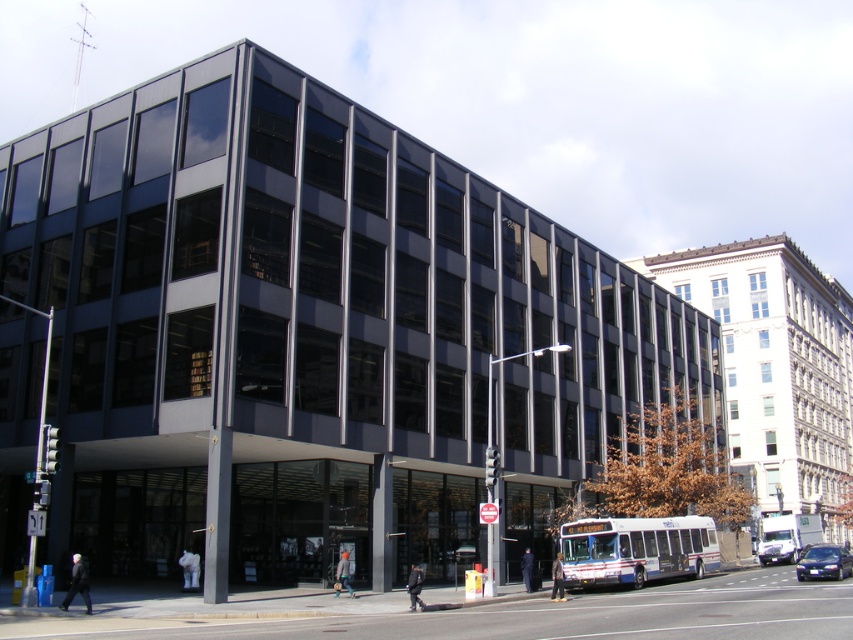
Question: Is white metallic bus at center behind metallic blue sedan at center?

Choices:
 (A) yes
 (B) no

Answer: (A)

Question: Does white matte bus at center appear over metallic blue sedan at center?

Choices:
 (A) no
 (B) yes

Answer: (A)

Question: Among these objects, which one is farthest from the camera?

Choices:
 (A) white matte bus at center
 (B) metallic blue sedan at center

Answer: (A)

Question: Which point is farther to the camera?

Choices:
 (A) (572, 545)
 (B) (811, 540)
 (C) (825, 552)

Answer: (B)

Question: Does white matte bus at center appear under metallic blue sedan at center?

Choices:
 (A) yes
 (B) no

Answer: (A)

Question: Among these objects, which one is farthest from the camera?

Choices:
 (A) metallic blue sedan at center
 (B) white metallic bus at center

Answer: (B)